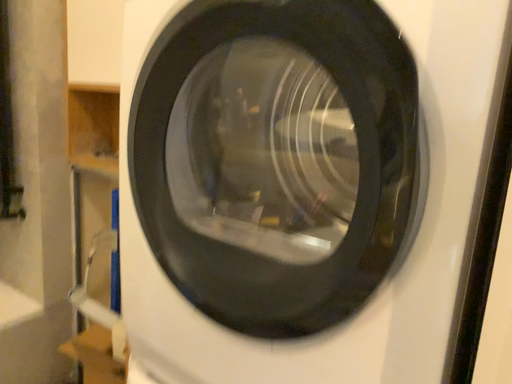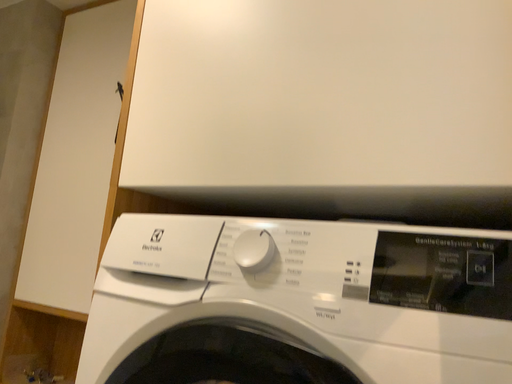
Question: Which way did the camera rotate in the video?

Choices:
 (A) rotated left
 (B) rotated right

Answer: (B)